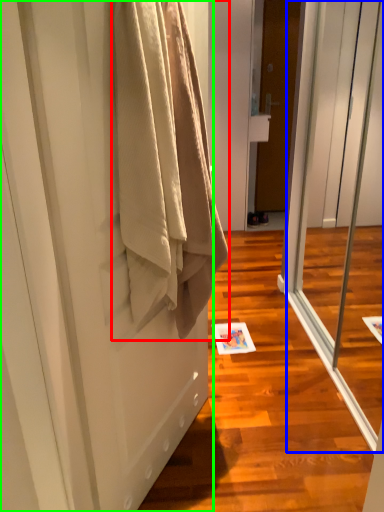
Question: Estimate the real-world distances between objects in this image. Which object is farther from towel (highlighted by a red box), screen door (highlighted by a blue box) or door (highlighted by a green box)?

Choices:
 (A) screen door
 (B) door

Answer: (A)